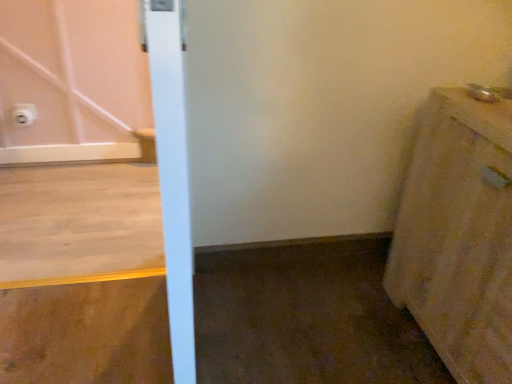
Question: Is white plastic electric outlet at upper left bigger or smaller than beige fabric cabinet at right?

Choices:
 (A) big
 (B) small

Answer: (B)

Question: Is white plastic electric outlet at upper left spatially inside beige fabric cabinet at right, or outside of it?

Choices:
 (A) outside
 (B) inside

Answer: (A)

Question: From the image's perspective, is white plastic electric outlet at upper left located above or below beige fabric cabinet at right?

Choices:
 (A) below
 (B) above

Answer: (B)

Question: Is beige fabric cabinet at right in front of or behind white plastic electric outlet at upper left in the image?

Choices:
 (A) front
 (B) behind

Answer: (A)

Question: Is point (414, 314) positioned closer to the camera than point (18, 112)?

Choices:
 (A) farther
 (B) closer

Answer: (B)

Question: Considering the positions of beige fabric cabinet at right and white plastic electric outlet at upper left in the image, is beige fabric cabinet at right bigger or smaller than white plastic electric outlet at upper left?

Choices:
 (A) small
 (B) big

Answer: (B)

Question: Is beige fabric cabinet at right wider or thinner than white plastic electric outlet at upper left?

Choices:
 (A) thin
 (B) wide

Answer: (B)